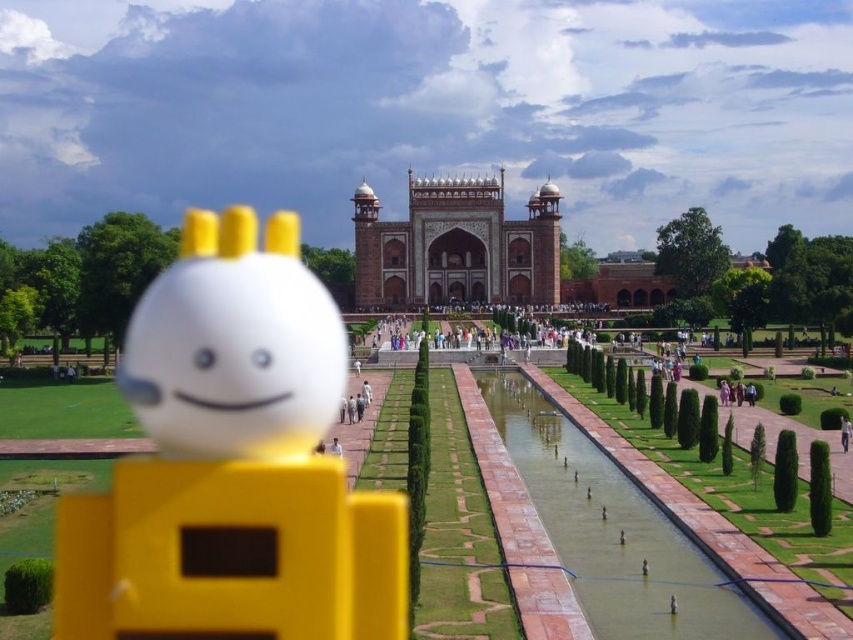
Is point (477, 256) farther from camera compared to point (844, 428)?

Yes, point (477, 256) is behind point (844, 428).

Between point (426, 195) and point (846, 433), which one is positioned behind?

Point (426, 195)

The image size is (853, 640). Identify the location of marble taj mahal at center. (456, 246).

Which is more to the left, yellow matte toy at center or white matte person at center?

From the viewer's perspective, yellow matte toy at center appears more on the left side.

Can you confirm if yellow matte toy at center is shorter than white matte person at center?

Incorrect, yellow matte toy at center's height does not fall short of white matte person at center's.

Where is `yellow matte toy at center`? The height and width of the screenshot is (640, 853). yellow matte toy at center is located at coordinates (231, 465).

Does yellow matte toy at center have a smaller size compared to marble taj mahal at center?

No, yellow matte toy at center is not smaller than marble taj mahal at center.

Between point (326, 291) and point (453, 282), which one is positioned in front?

Point (326, 291)

This screenshot has height=640, width=853. Find the location of `yellow matte toy at center`. yellow matte toy at center is located at coordinates pos(231,465).